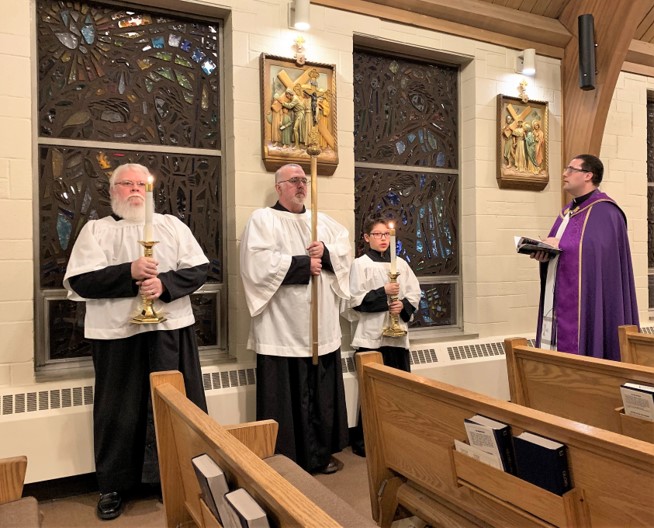
Where is `radiator`? radiator is located at coordinates (57, 429), (235, 396), (481, 369).